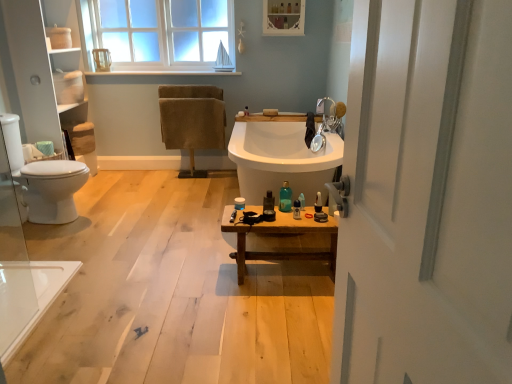
The height and width of the screenshot is (384, 512). I want to click on free space that is to the left of translucent plastic bottle at center, which appears as the third toiletry when viewed from the right, so click(267, 212).